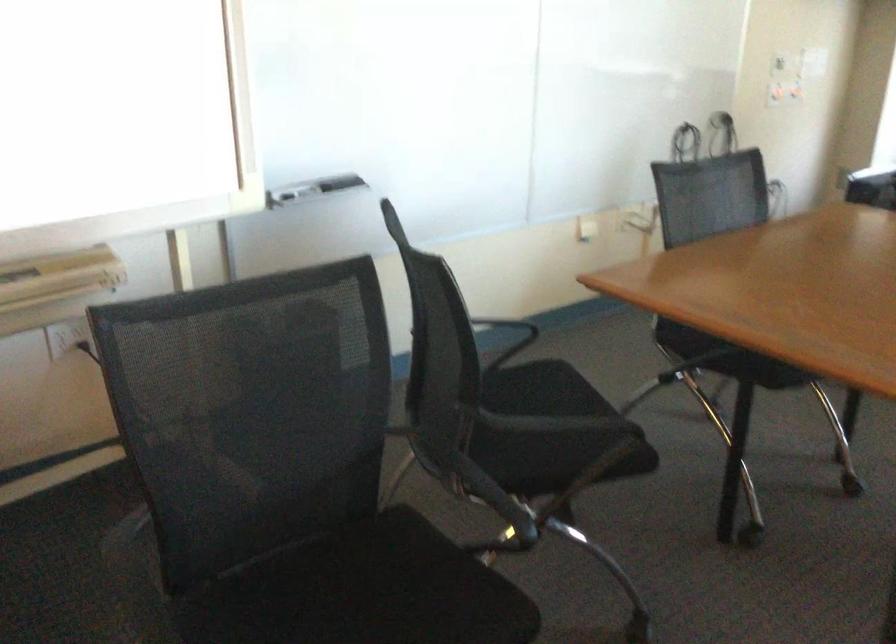
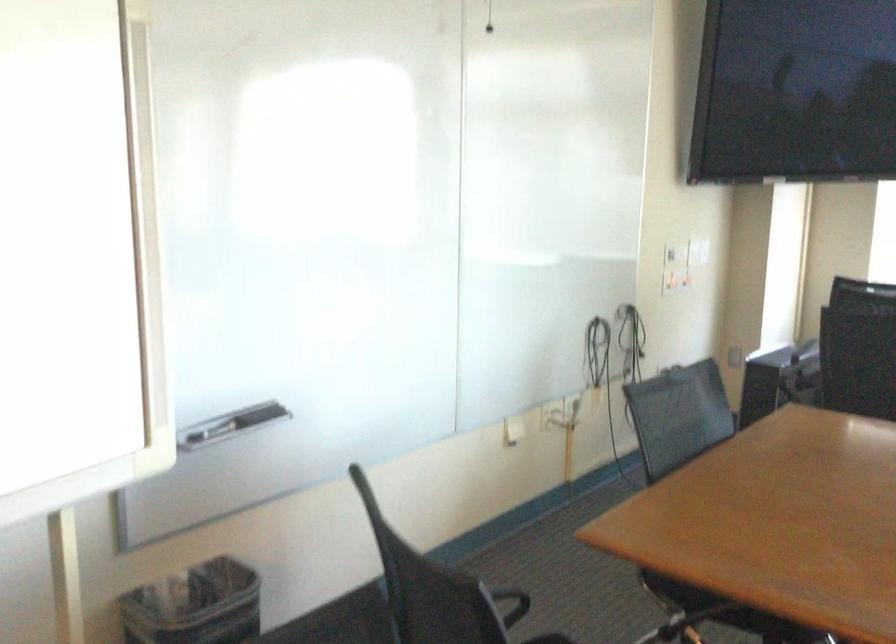
In a continuous first-person perspective shot, in which direction is the camera moving?

The cameraman walked toward left, forward.